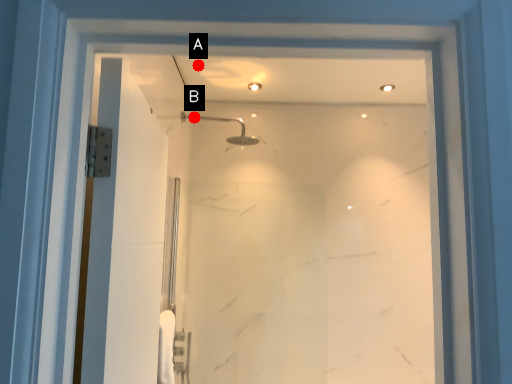
Question: Two points are circled on the image, labeled by A and B beside each circle. Which point is farther from the camera taking this photo?

Choices:
 (A) A is further
 (B) B is further

Answer: (B)